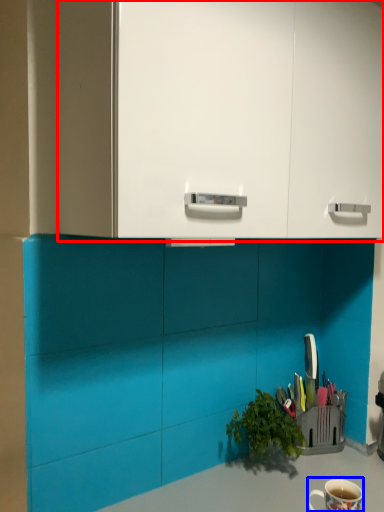
Question: Which of the following is the closest to the observer, dresser (highlighted by a red box) or coffee cup (highlighted by a blue box)?

Choices:
 (A) dresser
 (B) coffee cup

Answer: (A)